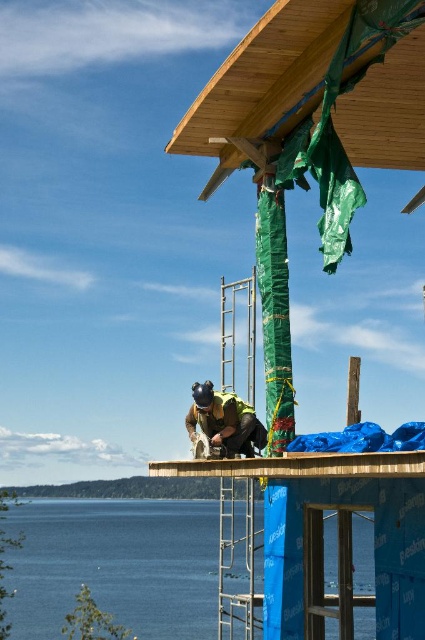
Between blue water at lower left and green safety vest at center, which one appears on the right side from the viewer's perspective?

blue water at lower left

Locate an element on the screen. The width and height of the screenshot is (425, 640). blue water at lower left is located at coordinates (116, 564).

The image size is (425, 640). Identify the location of blue water at lower left. (116, 564).

Does blue water at lower left appear under natural wood roof at upper center?

Indeed, blue water at lower left is positioned under natural wood roof at upper center.

Between blue water at lower left and natural wood roof at upper center, which one is positioned lower?

Positioned lower is blue water at lower left.

What are the coordinates of `blue water at lower left` in the screenshot? It's located at (116, 564).

Does natural wood roof at upper center have a smaller size compared to green safety vest at center?

Actually, natural wood roof at upper center might be larger than green safety vest at center.

Is point (309, 20) positioned in front of point (255, 444)?

Yes, point (309, 20) is closer to viewer.

Does point (348, 93) come in front of point (207, 435)?

Yes, point (348, 93) is closer to viewer.

Locate an element on the screen. The image size is (425, 640). natural wood roof at upper center is located at coordinates (263, 83).